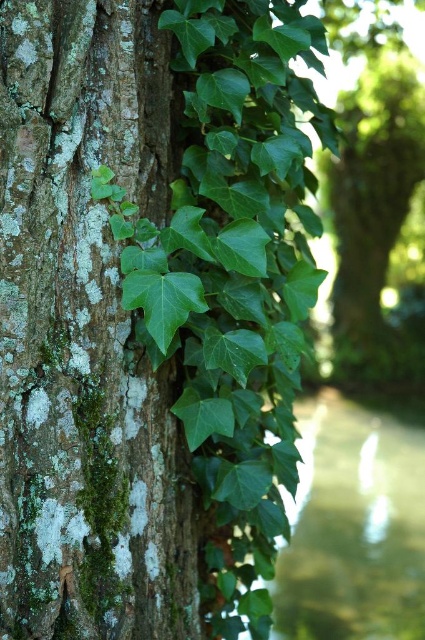
You are an artist painting this scene. You have to decide which area to focus on first based on their sizes. Which object should you start with, the green mossy bark at left or the green leafy creeks at lower right?

The green leafy creeks at lower right occupy more space than the green mossy bark at left, so you should start with the green leafy creeks at lower right to ensure you have enough time to detail the larger area first.